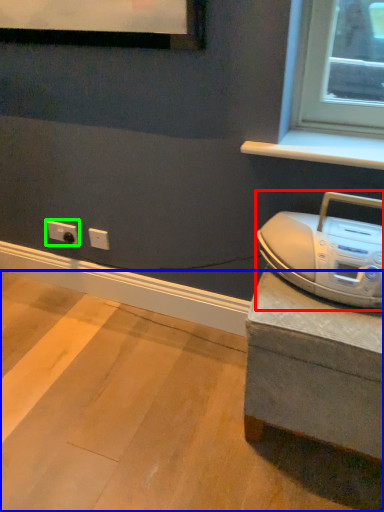
Question: Which object is positioned farthest from home appliance (highlighted by a red box)? Select from concrete (highlighted by a blue box) and electric outlet (highlighted by a green box).

Choices:
 (A) concrete
 (B) electric outlet

Answer: (B)